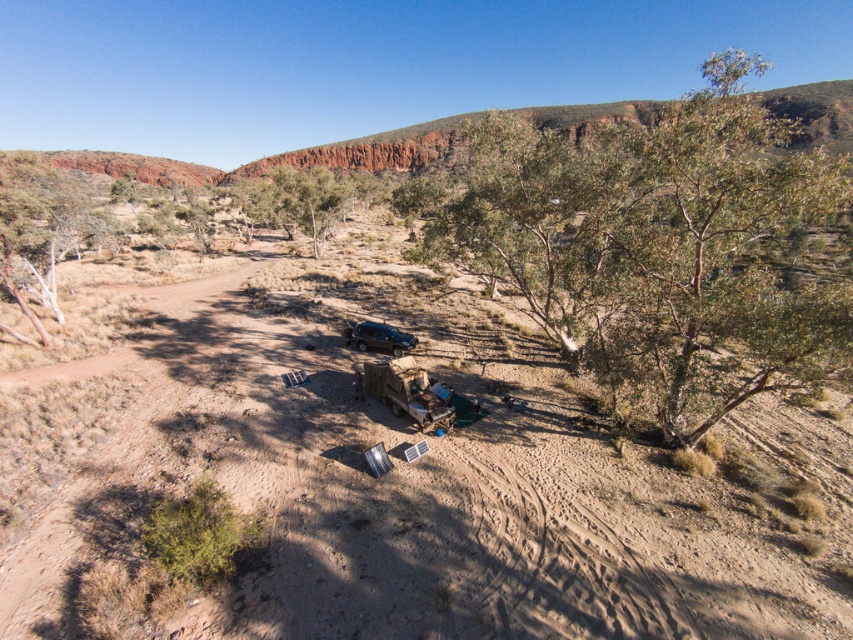
Based on the photo, you are a hiker trying to set up camp. You have a choice between the brown sandy dirt field at center and the matte black jeep at center. Which location would provide a more stable foundation for your tent?

The brown sandy dirt field at center is positioned over the matte black jeep at center, so the jeep is actually underneath the dirt field. Therefore, the matte black jeep at center is not a suitable surface for a tent. The brown sandy dirt field at center would be the better choice for stability.

You are standing at the parked truck and want to walk to the distant hillside with the reddish rock formations. There are two points marked on the ground in front of you. Which point, point (x=370, y=579) or point (x=366, y=333), is closer to your current position?

Point (x=366, y=333) is closer to your current position because it is behind point (x=370, y=579), which is further away.